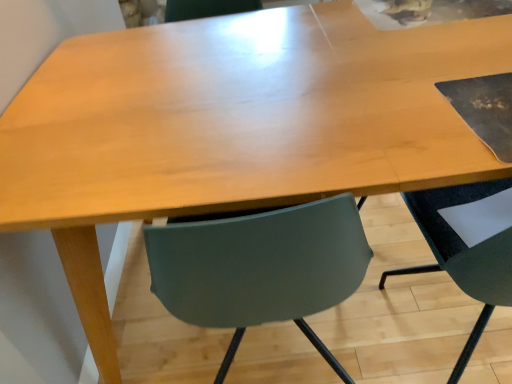
What do you see at coordinates (467, 246) in the screenshot? I see `matte green chair at right` at bounding box center [467, 246].

Find the location of a particular element. matte green chair at right is located at coordinates (467, 246).

What is the approximate width of matte green chair at right?

The width of matte green chair at right is 20.74 inches.

Image resolution: width=512 pixels, height=384 pixels. What are the coordinates of `matte green chair at right` in the screenshot? It's located at (467, 246).